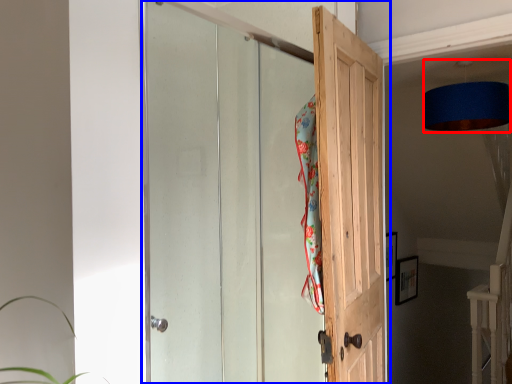
Question: Which of the following is the closest to the observer, lamp (highlighted by a red box) or door (highlighted by a blue box)?

Choices:
 (A) lamp
 (B) door

Answer: (B)